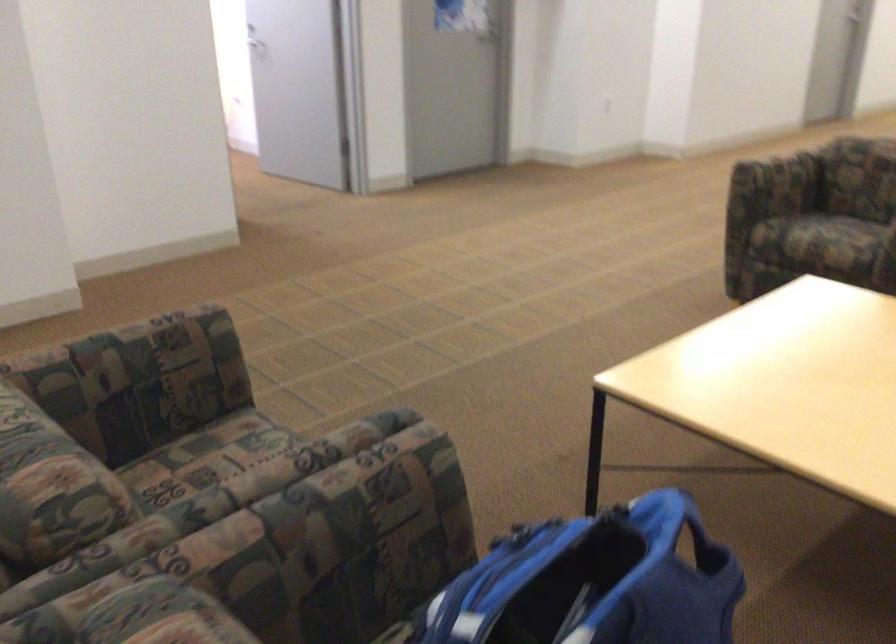
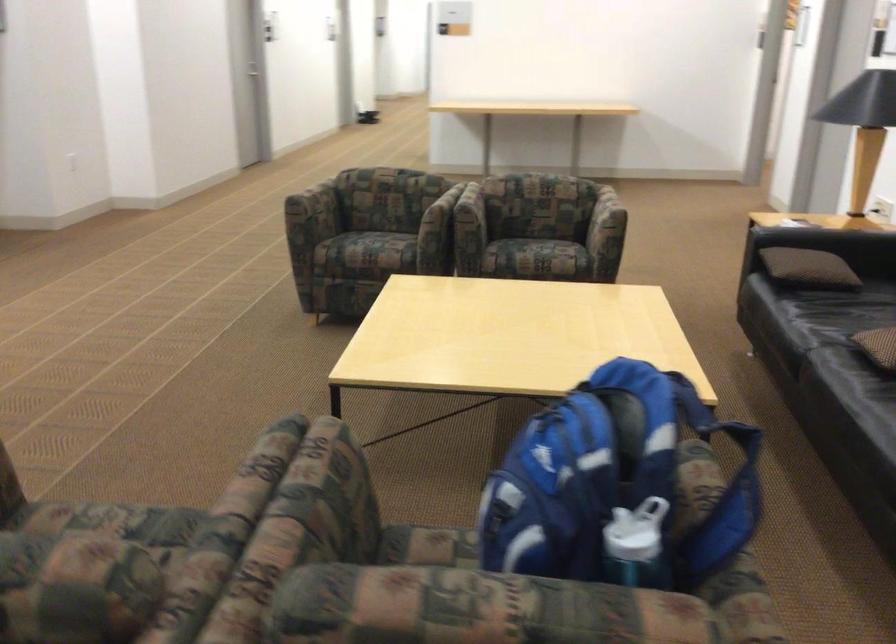
Question: The first image is from the beginning of the video and the second image is from the end. How did the camera likely rotate when shooting the video?

Choices:
 (A) Left
 (B) Right
 (C) Up
 (D) Down

Answer: (B)